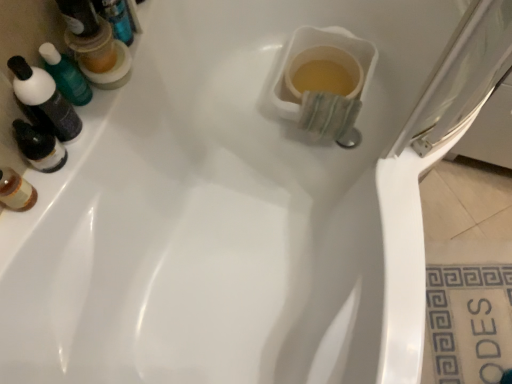
Question: Does point (99, 24) appear closer or farther from the camera than point (459, 347)?

Choices:
 (A) closer
 (B) farther

Answer: (A)

Question: From a real-world perspective, is translucent plastic mouthwash at upper left, which appears as the 2th mouthwash when ordered from the bottom, positioned above or below white ceramic tile at lower right?

Choices:
 (A) above
 (B) below

Answer: (A)

Question: Which object is the farthest from the translucent plastic mouthwash at upper left, the second mouthwash from the top?

Choices:
 (A) translucent plastic mouthwash at upper left, which appears as the 2th mouthwash when ordered from the bottom
 (B) white ceramic tile at lower right
 (C) transparent plastic screen door at upper right

Answer: (B)

Question: Which object is the farthest from the translucent plastic mouthwash at upper left, which is counted as the 1th mouthwash, starting from the top?

Choices:
 (A) transparent plastic screen door at upper right
 (B) translucent plastic mouthwash at upper left, which appears as the first mouthwash when ordered from the bottom
 (C) white ceramic tile at lower right

Answer: (C)